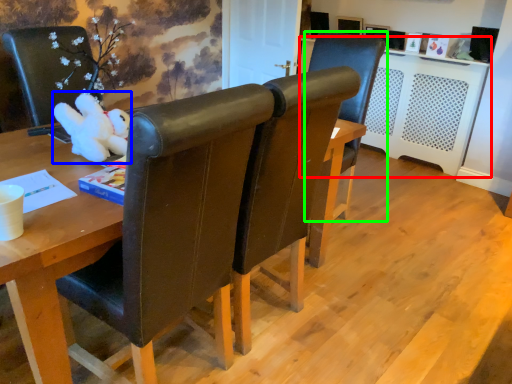
Question: Which object is positioned closest to computer desk (highlighted by a red box)? Select from toy (highlighted by a blue box) and chair (highlighted by a green box).

Choices:
 (A) toy
 (B) chair

Answer: (B)